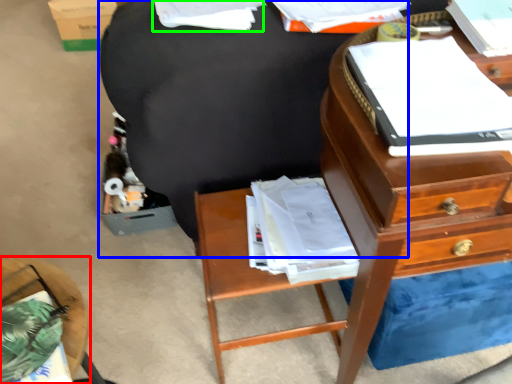
Question: Which is nearer to the nightstand (highlighted by a red box)? bean bag chair (highlighted by a blue box) or book (highlighted by a green box).

Choices:
 (A) bean bag chair
 (B) book

Answer: (A)